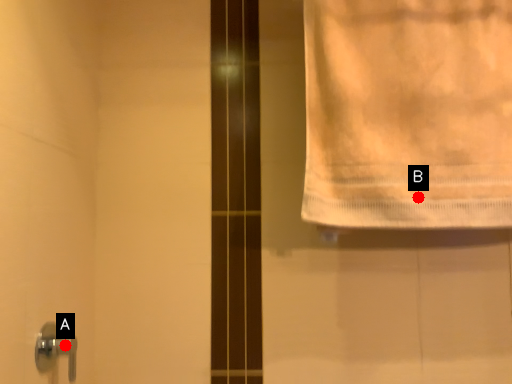
Question: Two points are circled on the image, labeled by A and B beside each circle. Which point is closer to the camera taking this photo?

Choices:
 (A) A is closer
 (B) B is closer

Answer: (B)